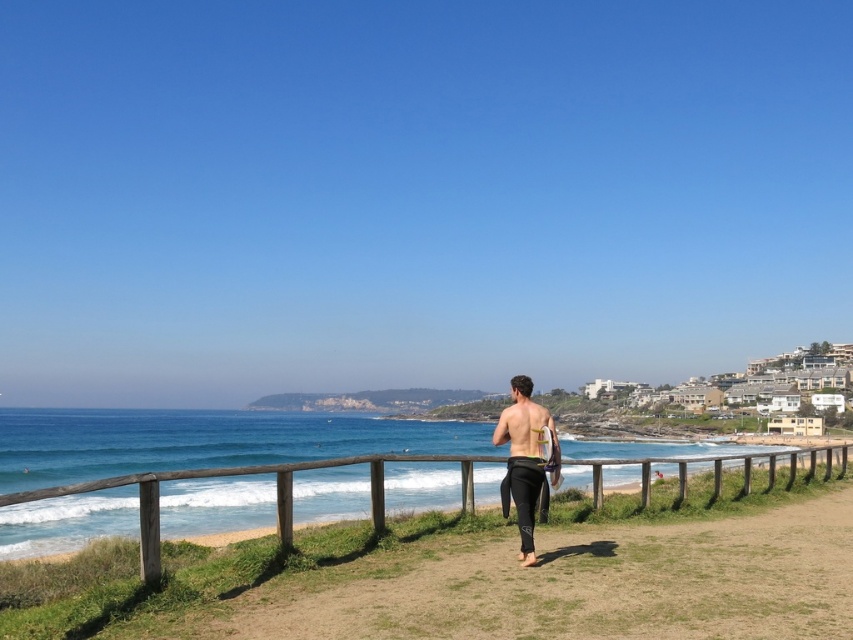
You are standing on the sandy path and see the wooden at center and the black wetsuit at center. Which object is closer to the beach?

The wooden at center is located below the black wetsuit at center, meaning it is closer to the beach.

You are standing on the sandy path and want to pick up the wooden at center and the black wetsuit at center. Which object can you reach first without moving your feet?

The wooden at center is closer to the viewer than the black wetsuit at center, so you can reach the wooden at center first without moving your feet.

You are standing on the sandy path and see the wooden at center and the black wetsuit at center. Which object is positioned to the right when facing the beach?

The wooden at center is to the right of the black wetsuit at center when facing the beach.